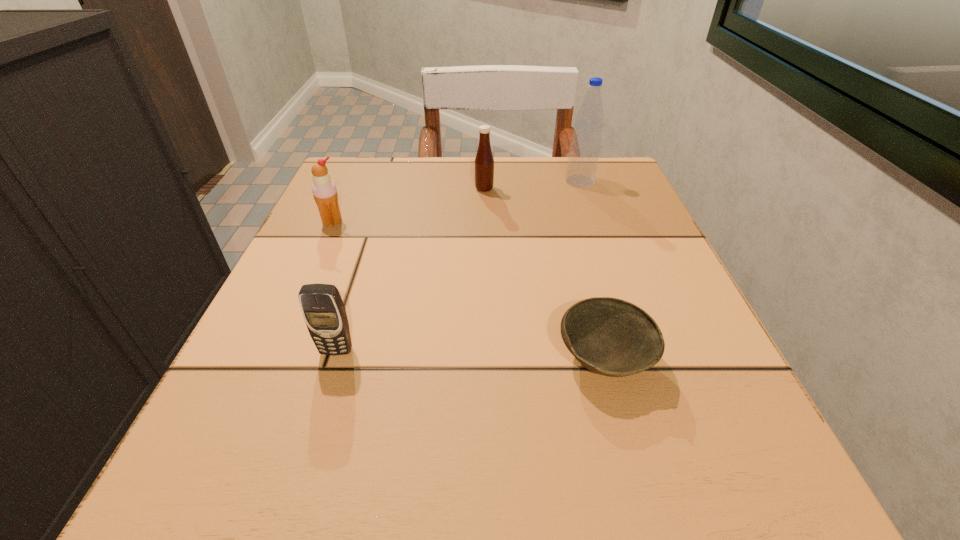
Find the location of `vacant space at the left edge`. vacant space at the left edge is located at coordinates (373, 237).

In the image, there is a desktop. Where is `vacant space at the right edge`? The image size is (960, 540). vacant space at the right edge is located at coordinates (x=630, y=280).

At what (x,y) coordinates should I click in order to perform the action: click on free space at the far left corner of the desktop. Please return your answer as a coordinate pair (x, y). Looking at the image, I should click on (378, 167).

You are a GUI agent. You are given a task and a screenshot of the screen. Output one action in this format:
    pyautogui.click(x=<x>, y=<y>)
    Task: Click on the free space between the Tabasco sauce and the tallest object
    
    Given the screenshot: What is the action you would take?
    pyautogui.click(x=532, y=185)

This screenshot has height=540, width=960. Find the location of `unoccupied area between the bowl and the fourth object from right to left`. unoccupied area between the bowl and the fourth object from right to left is located at coordinates (470, 355).

The image size is (960, 540). Identify the location of free spot between the Tabasco sauce and the icecream. pos(408,205).

Where is `vacant area that lies between the third farthest object and the bowl`? vacant area that lies between the third farthest object and the bowl is located at coordinates (468, 291).

Find the location of a particular element. This screenshot has width=960, height=540. vacant area between the shortest object and the third object from right to left is located at coordinates click(x=544, y=274).

This screenshot has height=540, width=960. What are the coordinates of `empty space that is in between the shortest object and the tallest object` in the screenshot? It's located at (592, 271).

Locate an element on the screen. unoccupied position between the water bottle and the bowl is located at coordinates (592, 271).